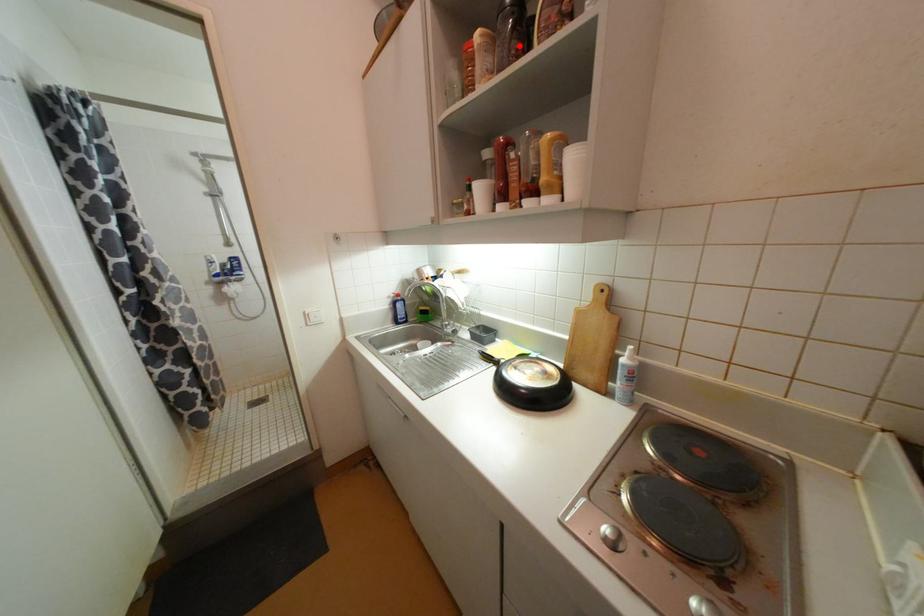
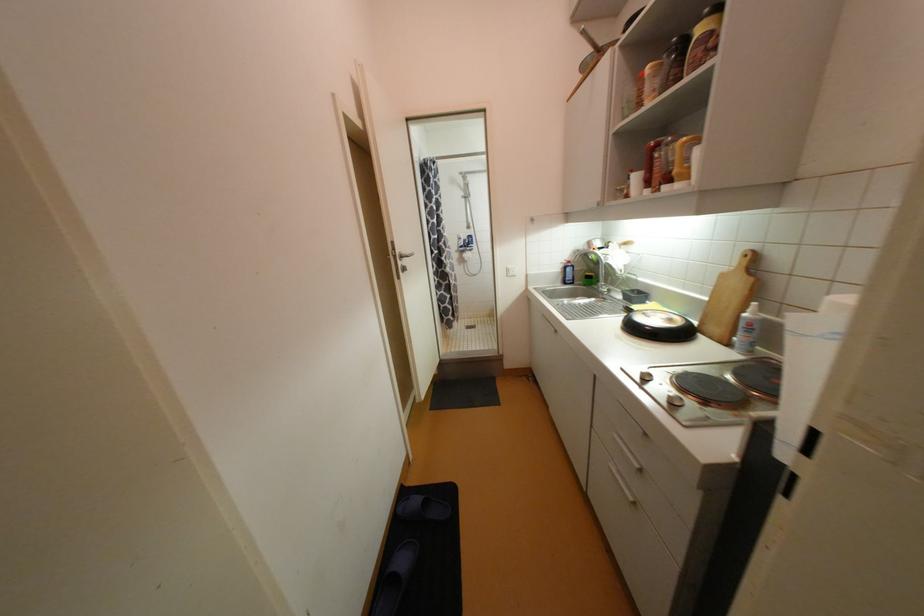
In the second image, find the point that corresponds to the highlighted location in the first image.

(678, 71)